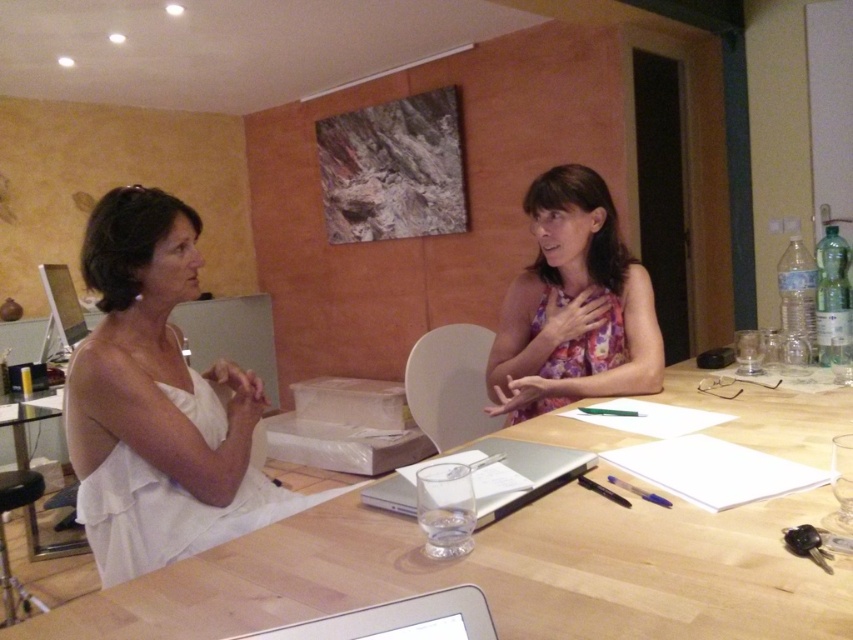
Looking at this image, you are a photographer who wants to take a photo of the woman in the white satin dress at left. The camera you are using has a minimum focusing distance of 1 meter. Can you take a clear photo of her without moving closer?

The white satin dress at left and camera are 1.26 meters apart from each other. Since the minimum focusing distance is 1 meter, the photographer can take a clear photo of the woman in the white satin dress at left without moving closer because the distance is within the camera

You are a photographer setting up a shoot in this room. You need to place a small prop exactly at the point marked as point (157, 403). What object will the prop be placed on?

The prop will be placed on the white satin dress at left, as the point (157, 403) corresponds to that object.

You are sitting at the wooden table in the room and want to reach for the white glossy laptop at center to check an email. However, there is a floral fabric dress at center in your way. Can you easily access the laptop without moving the dress?

The white glossy laptop at center is behind the floral fabric dress at center, so you can access it without moving the dress as it is positioned behind.